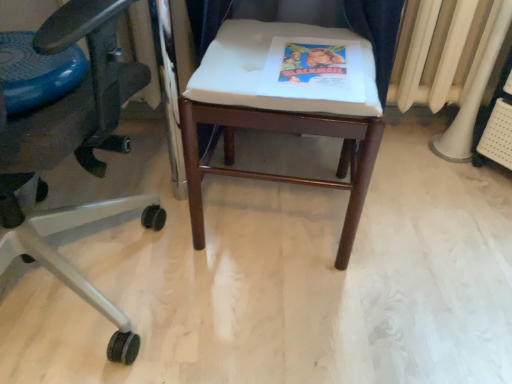
Where is `blank space to the left of white plastic radiator at right`? blank space to the left of white plastic radiator at right is located at coordinates (404, 152).